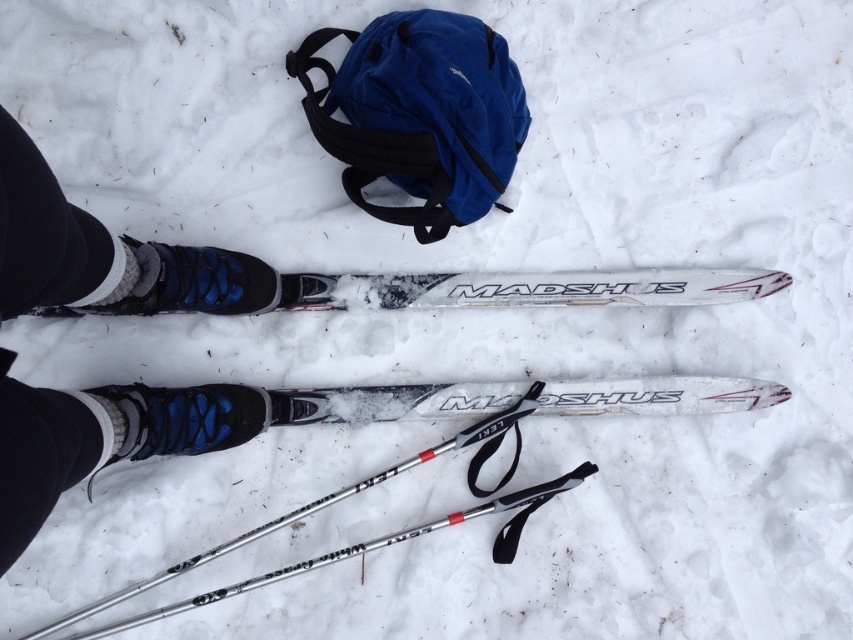
You are standing at the point marked by the coordinates point (x=393, y=401) in the snowy scene. What object are you directly on top of?

The point (x=393, y=401) is directly on top of the white matte madshus ski at center.

You are trying to organize your gear for a cross country ski trip. You have a white matte ski at lower center and a white matte madshus ski at center. Which ski is positioned to the right of the other?

The white matte ski at lower center is to the right of the white matte madshus ski at center.